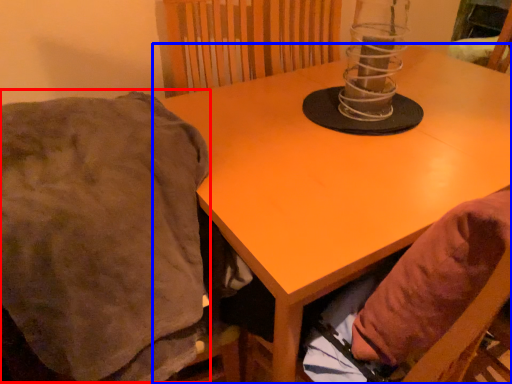
Question: Which of the following is the farthest to the observer, blanket (highlighted by a red box) or table (highlighted by a blue box)?

Choices:
 (A) blanket
 (B) table

Answer: (B)